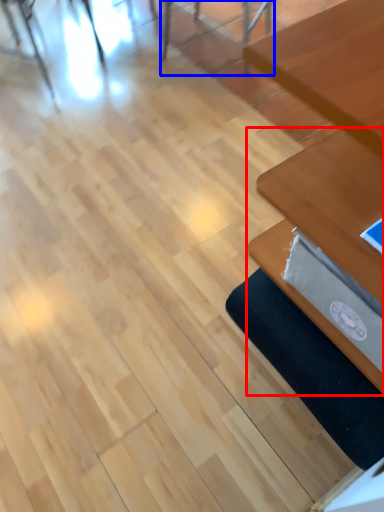
Question: Which object is closer to the camera taking this photo, table (highlighted by a red box) or chair (highlighted by a blue box)?

Choices:
 (A) table
 (B) chair

Answer: (A)